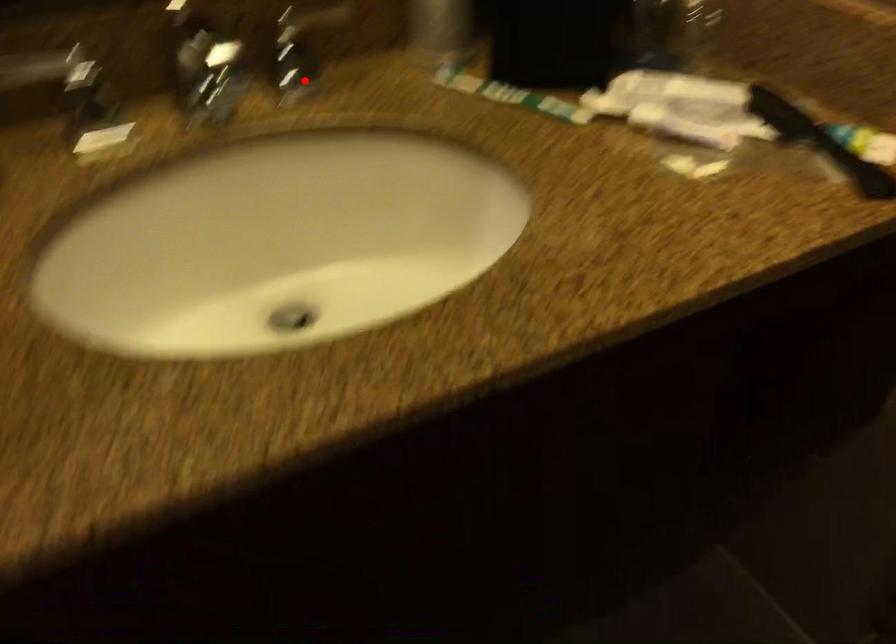
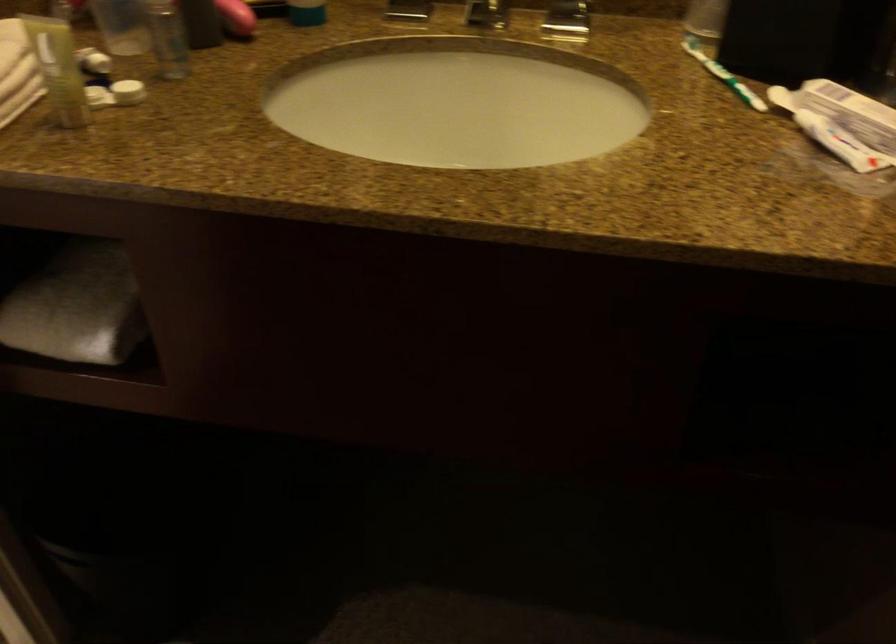
Question: I am providing you with two images of the same scene from different viewpoints. Image1 has a red point marked. In image2, the corresponding 3D location appears at what relative position? Reply with the corresponding letter.

Choices:
 (A) Closer
 (B) Farther

Answer: (B)